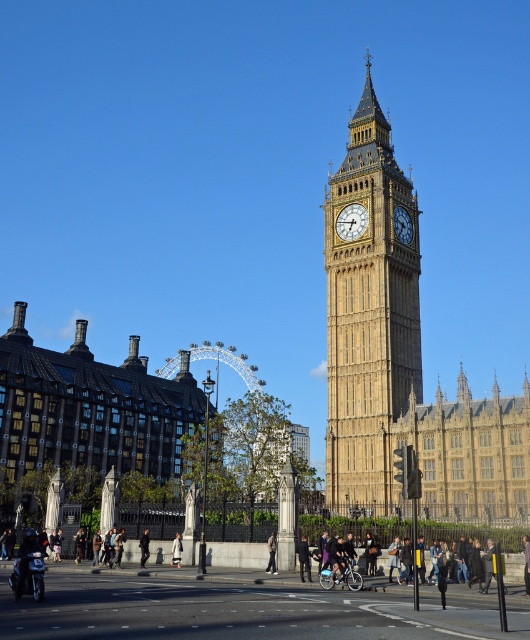
Question: Can you confirm if shiny black motorcycle at lower left is positioned above golden stone clock at center?

Choices:
 (A) yes
 (B) no

Answer: (B)

Question: Which is farther from the dark brown leather jacket at lower left?

Choices:
 (A) dark blue jeans at lower center
 (B) khaki fabric jacket at center
 (C) golden stone clock tower at center

Answer: (C)

Question: Does golden stone clock tower at center lie behind dark blue jeans at center?

Choices:
 (A) no
 (B) yes

Answer: (B)

Question: Considering the real-world distances, which object is closest to the dark blue jeans at center?

Choices:
 (A) yellow stone building at center
 (B) shiny chrome motorcycle at center

Answer: (B)

Question: Which point is farther to the camera?

Choices:
 (A) shiny black motorcycle at lower left
 (B) golden stone clock at center

Answer: (B)

Question: Can you confirm if golden stone clock at center is positioned above dark blue jeans at center?

Choices:
 (A) yes
 (B) no

Answer: (A)